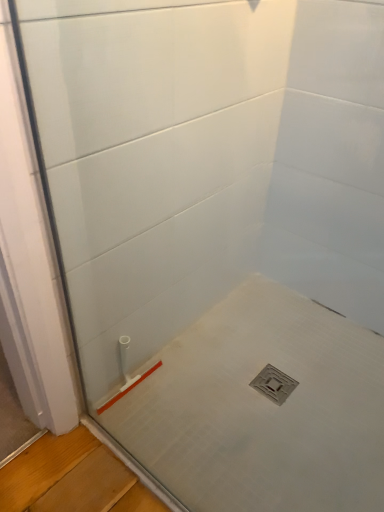
Describe the element at coordinates (126, 375) in the screenshot. I see `white plastic pipe at lower left` at that location.

The image size is (384, 512). Find the location of `white plastic pipe at lower left`. white plastic pipe at lower left is located at coordinates (126, 375).

Find the location of a particular element. The height and width of the screenshot is (512, 384). white plastic pipe at lower left is located at coordinates (126, 375).